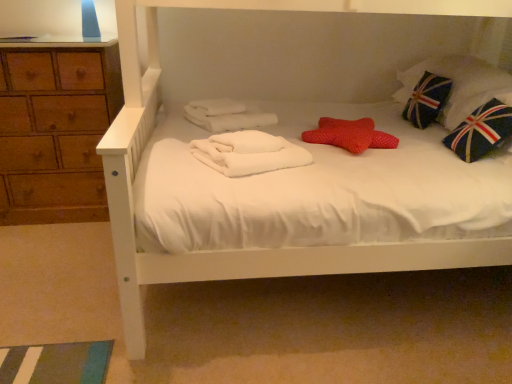
Question: Is union jack fabric pillow at upper right, acting as the 2th pillow starting from the front, at the left side of blue fabric pillow with union jack design at right?

Choices:
 (A) no
 (B) yes

Answer: (B)

Question: From the image's perspective, is union jack fabric pillow at upper right, positioned as the 2th pillow in bottom-to-top order, located beneath blue fabric pillow with union jack design at right?

Choices:
 (A) yes
 (B) no

Answer: (B)

Question: From a real-world perspective, is union jack fabric pillow at upper right, acting as the 2th pillow starting from the front, on top of blue fabric pillow with union jack design at right?

Choices:
 (A) yes
 (B) no

Answer: (A)

Question: Is union jack fabric pillow at upper right, the first pillow from the back, not close to blue fabric pillow with union jack design at right?

Choices:
 (A) no
 (B) yes

Answer: (A)

Question: Can you confirm if union jack fabric pillow at upper right, which is counted as the second pillow, starting from the left, is smaller than blue fabric pillow with union jack design at right?

Choices:
 (A) yes
 (B) no

Answer: (B)

Question: Considering the positions of union jack fabric pillow at upper right, positioned as the 2th pillow in bottom-to-top order, and white soft towel at center in the image, is union jack fabric pillow at upper right, positioned as the 2th pillow in bottom-to-top order, taller or shorter than white soft towel at center?

Choices:
 (A) tall
 (B) short

Answer: (A)

Question: From a real-world perspective, is union jack fabric pillow at upper right, the first pillow from the back, physically located above or below white soft towel at center?

Choices:
 (A) below
 (B) above

Answer: (B)

Question: Would you say union jack fabric pillow at upper right, which is counted as the second pillow, starting from the left, is inside or outside white soft towel at center?

Choices:
 (A) outside
 (B) inside

Answer: (A)

Question: From the image's perspective, is union jack fabric pillow at upper right, the first pillow from the back, located above or below white soft towel at center?

Choices:
 (A) below
 (B) above

Answer: (B)

Question: Considering the positions of blue fabric pillow with union jack design at right and union jack fabric pillow at upper right, positioned as the 2th pillow in bottom-to-top order, in the image, is blue fabric pillow with union jack design at right bigger or smaller than union jack fabric pillow at upper right, positioned as the 2th pillow in bottom-to-top order,?

Choices:
 (A) big
 (B) small

Answer: (B)

Question: From a real-world perspective, is blue fabric pillow with union jack design at right physically located above or below union jack fabric pillow at upper right, acting as the 2th pillow starting from the front?

Choices:
 (A) below
 (B) above

Answer: (A)

Question: Is point coord(485,107) positioned closer to the camera than point coord(476,66)?

Choices:
 (A) closer
 (B) farther

Answer: (A)

Question: Is blue fabric pillow with union jack design at right situated inside union jack fabric pillow at upper right, which appears as the 1th pillow when viewed from the right, or outside?

Choices:
 (A) inside
 (B) outside

Answer: (B)

Question: Is union jack fabric pillow at upper right, the first pillow from the back, to the left or to the right of blue fabric pillow with union jack design at right in the image?

Choices:
 (A) right
 (B) left

Answer: (B)

Question: Considering the positions of union jack fabric pillow at upper right, which is counted as the second pillow, starting from the left, and blue fabric pillow with union jack design at right in the image, is union jack fabric pillow at upper right, which is counted as the second pillow, starting from the left, bigger or smaller than blue fabric pillow with union jack design at right?

Choices:
 (A) big
 (B) small

Answer: (A)